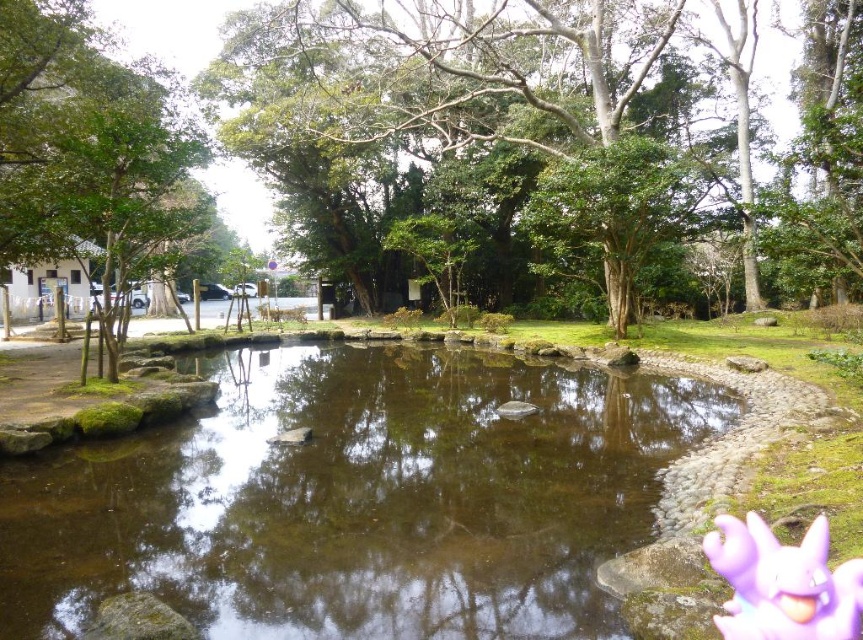
Question: Is clear water at center thinner than green leafy tree at center?

Choices:
 (A) no
 (B) yes

Answer: (B)

Question: Is clear water at center smaller than green leafy tree at center?

Choices:
 (A) yes
 (B) no

Answer: (A)

Question: Among these objects, which one is nearest to the camera?

Choices:
 (A) clear water at center
 (B) green leafy tree at center

Answer: (A)

Question: Which object is farther from the camera taking this photo?

Choices:
 (A) green leafy tree at center
 (B) clear water at center

Answer: (A)

Question: Considering the relative positions of clear water at center and green leafy tree at center in the image provided, where is clear water at center located with respect to green leafy tree at center?

Choices:
 (A) below
 (B) above

Answer: (A)

Question: Which point is closer to the camera taking this photo?

Choices:
 (A) (439, 552)
 (B) (385, 120)

Answer: (A)